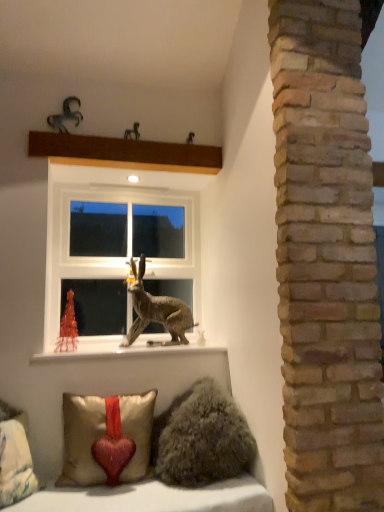
This screenshot has width=384, height=512. Identify the location of vacant space that's between satin gold pillow with red heart at lower left, the second pillow from the left, and fuzzy brown pillow at lower center, the fourth animal when ordered from back to front. (124, 497).